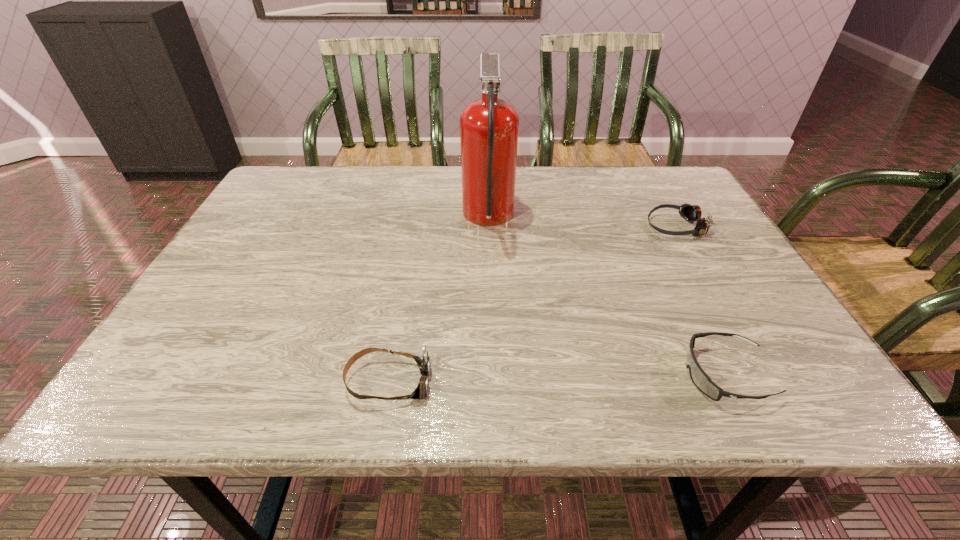
Identify the location of vacant point at the near right corner. Image resolution: width=960 pixels, height=540 pixels. tap(777, 387).

Where is `free space between the farthest goggles and the third object from right to left`? free space between the farthest goggles and the third object from right to left is located at coordinates (582, 222).

Locate an element on the screen. vacant region between the farthest goggles and the third object from right to left is located at coordinates (582, 222).

What are the coordinates of `vacant space in between the farthest goggles and the fire extinguisher` in the screenshot? It's located at (582, 222).

Where is `free spot between the leftmost object and the fire extinguisher`? free spot between the leftmost object and the fire extinguisher is located at coordinates (439, 300).

At what (x,y) coordinates should I click in order to perform the action: click on vacant point located between the second object from left to right and the leftmost goggles. Please return your answer as a coordinate pair (x, y). The width and height of the screenshot is (960, 540). Looking at the image, I should click on (439, 300).

Point out which object is positioned as the third nearest to the leftmost object. Please provide its 2D coordinates. Your answer should be formatted as a tuple, i.e. [(x, y)], where the tuple contains the x and y coordinates of a point satisfying the conditions above.

[(691, 213)]

Select which object is the closest to the fire extinguisher. Please provide its 2D coordinates. Your answer should be formatted as a tuple, i.e. [(x, y)], where the tuple contains the x and y coordinates of a point satisfying the conditions above.

[(423, 361)]

Locate an element on the screen. The image size is (960, 540). goggles identified as the second closest to the farthest goggles is located at coordinates (423, 361).

Identify the location of the third closest goggles to the tallest object. The height and width of the screenshot is (540, 960). (701, 380).